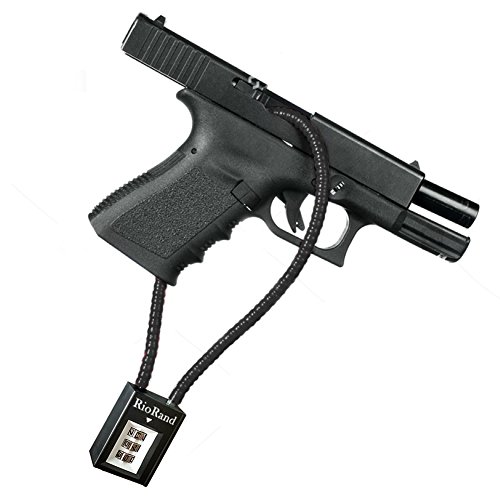
Locate an element on the screen. The width and height of the screenshot is (500, 500). handle is located at coordinates (172, 214).